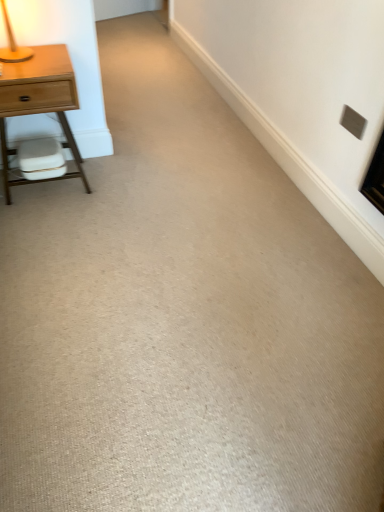
Where is `free location to the right of light wood/finish nightstand at left`? The height and width of the screenshot is (512, 384). free location to the right of light wood/finish nightstand at left is located at coordinates (126, 185).